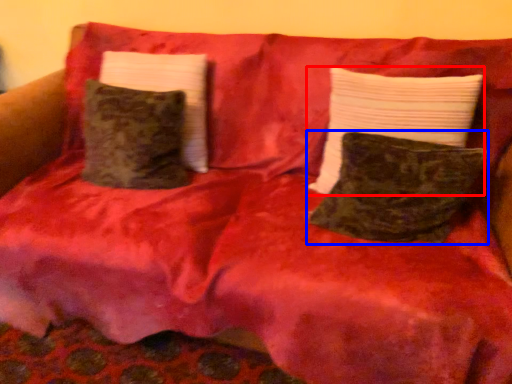
Question: Which object appears farthest to the camera in this image, pillow (highlighted by a red box) or pillow (highlighted by a blue box)?

Choices:
 (A) pillow
 (B) pillow

Answer: (A)